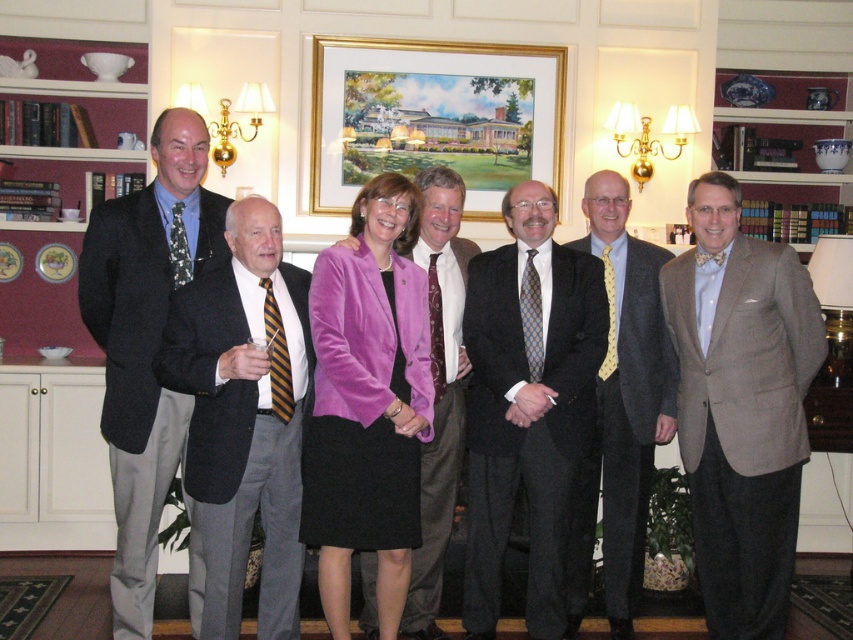
Question: Does matte black suit at center come behind green floral fabric tie at left?

Choices:
 (A) no
 (B) yes

Answer: (B)

Question: Does matte black suit at center appear on the right side of yellow striped tie at center?

Choices:
 (A) yes
 (B) no

Answer: (A)

Question: Estimate the real-world distances between objects in this image. Which object is farther from the light brown textured suit at center?

Choices:
 (A) dark gray suit at center
 (B) gold-framed painting at upper center
 (C) matte black suit at center

Answer: (B)

Question: Which point is farther to the camera?

Choices:
 (A) (x=527, y=275)
 (B) (x=502, y=486)
 (C) (x=616, y=362)

Answer: (C)

Question: Which object appears farthest from the camera in this image?

Choices:
 (A) green floral fabric tie at left
 (B) yellow striped tie at center
 (C) pink satin blazer at center

Answer: (C)

Question: Does light brown textured suit at center appear on the right side of yellow striped tie at center?

Choices:
 (A) yes
 (B) no

Answer: (A)